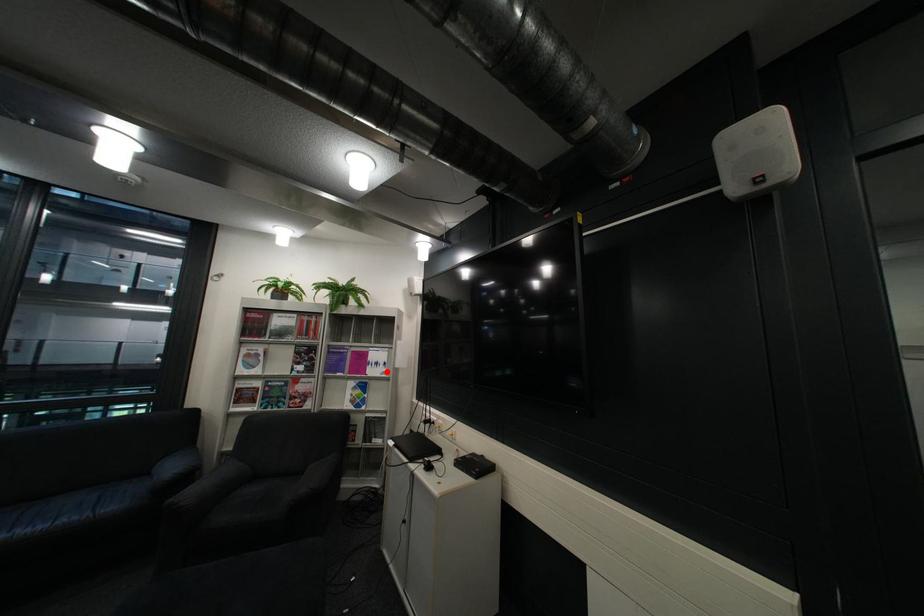
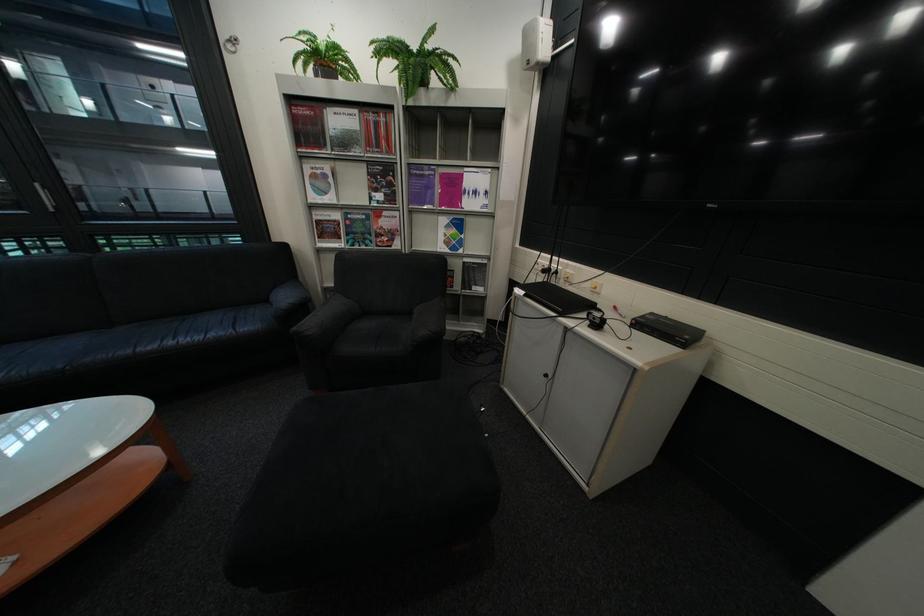
Question: I am providing you with two images of the same scene from different viewpoints. A red point is shown in image1. For the corresponding object point in image2, is it positioned nearer or farther from the camera?

Choices:
 (A) Nearer
 (B) Farther

Answer: (A)